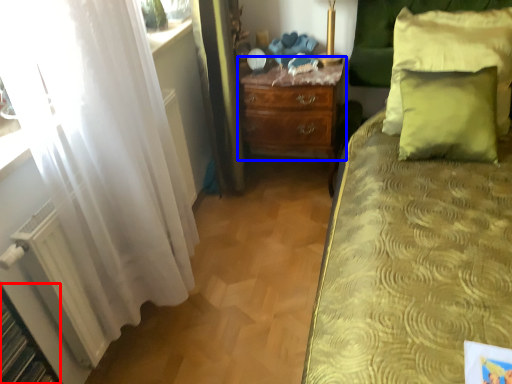
Question: Which object appears farthest to the camera in this image, shelf (highlighted by a red box) or nightstand (highlighted by a blue box)?

Choices:
 (A) shelf
 (B) nightstand

Answer: (B)